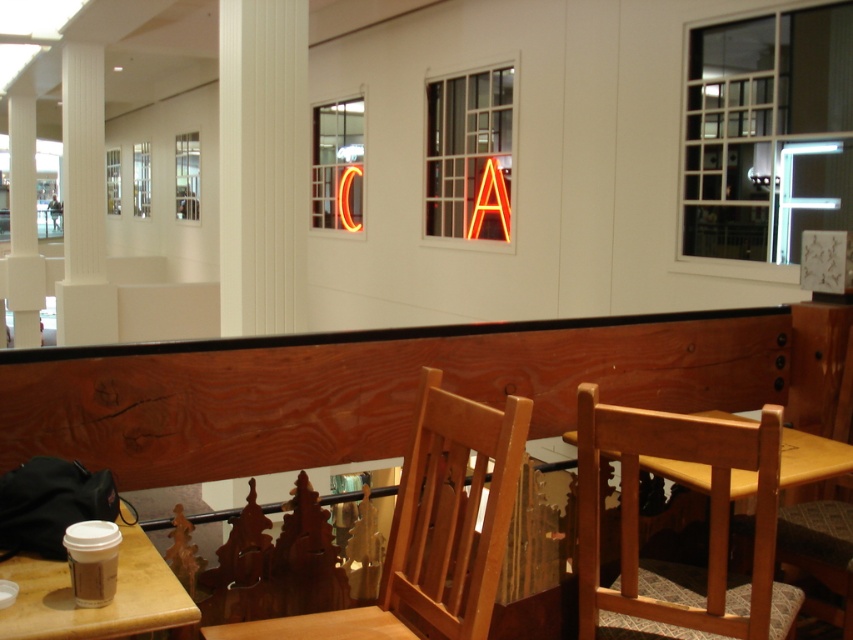
Question: Which point is farther from the camera taking this photo?

Choices:
 (A) (30, 630)
 (B) (229, 627)

Answer: (B)

Question: Can you confirm if wooden chair at center is positioned above white smooth column at center?

Choices:
 (A) no
 (B) yes

Answer: (A)

Question: Which object is positioned closest to the white smooth column at left?

Choices:
 (A) matte brown table at lower left
 (B) wooden chair at lower right
 (C) neon orange letter a at center
 (D) white smooth pillar at left

Answer: (D)

Question: Can you confirm if white smooth column at center is smaller than matte brown table at lower left?

Choices:
 (A) yes
 (B) no

Answer: (B)

Question: Which point is closer to the camera?

Choices:
 (A) neon orange letter a at center
 (B) wooden chair at center
 (C) white smooth column at center
 (D) white smooth column at left

Answer: (B)

Question: Does white smooth column at center appear on the right side of neon orange letter a at center?

Choices:
 (A) no
 (B) yes

Answer: (A)